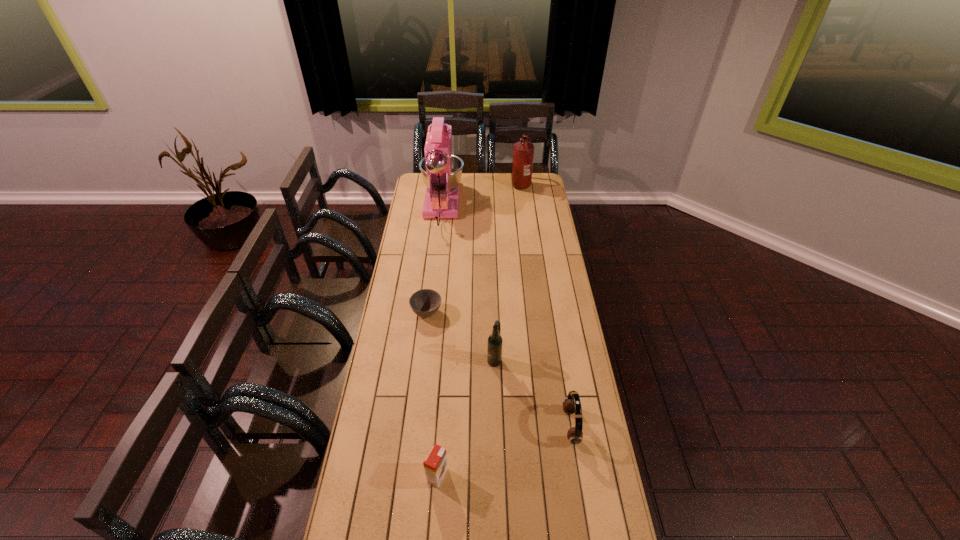
At what (x,y) coordinates should I click in order to perform the action: click on object that is the fifth closest to the fire extinguisher. Please return your answer as a coordinate pair (x, y). The image size is (960, 540). Looking at the image, I should click on (435, 464).